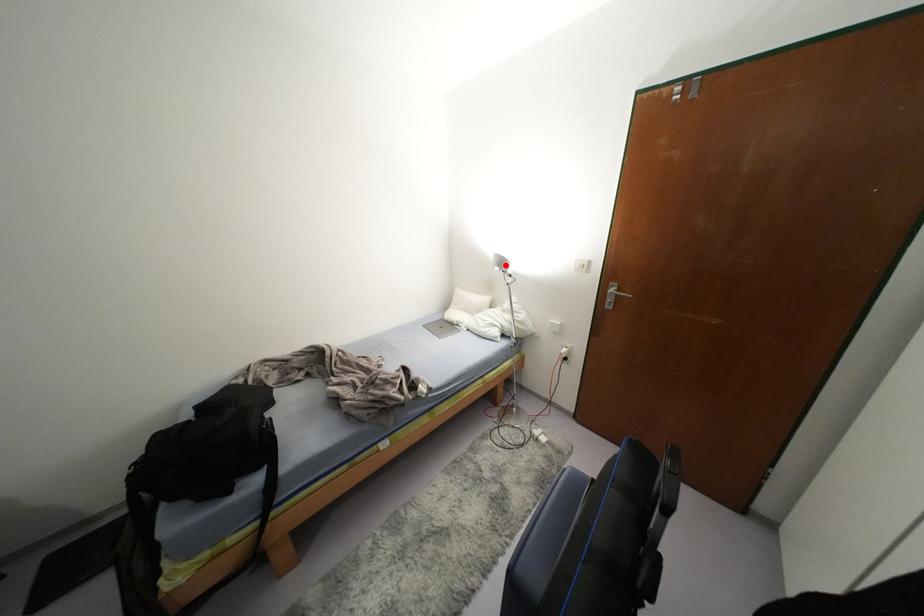
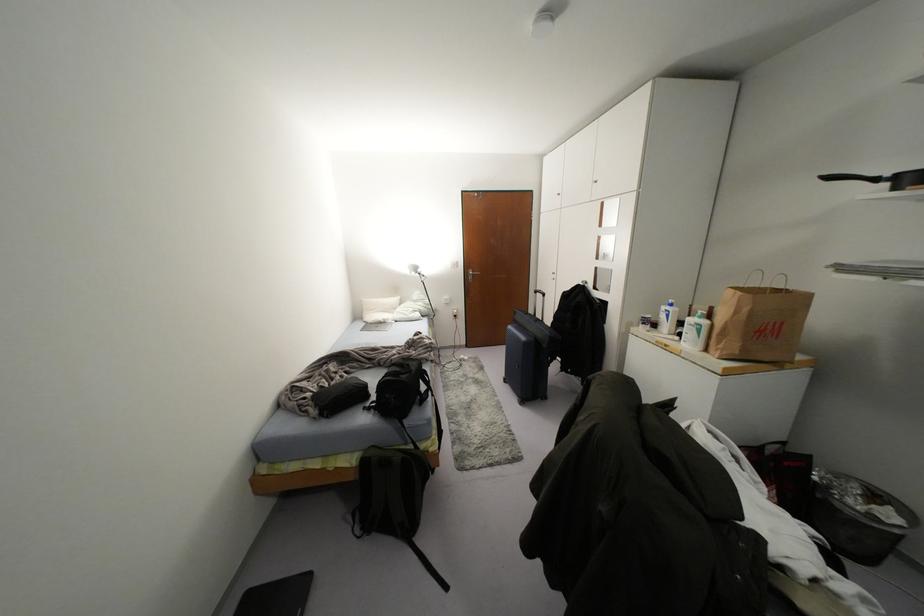
Question: I am providing you with two images of the same scene from different viewpoints. A red point is marked on the first image. Is the red point's position out of view in image 2?

Choices:
 (A) Yes
 (B) No

Answer: (B)